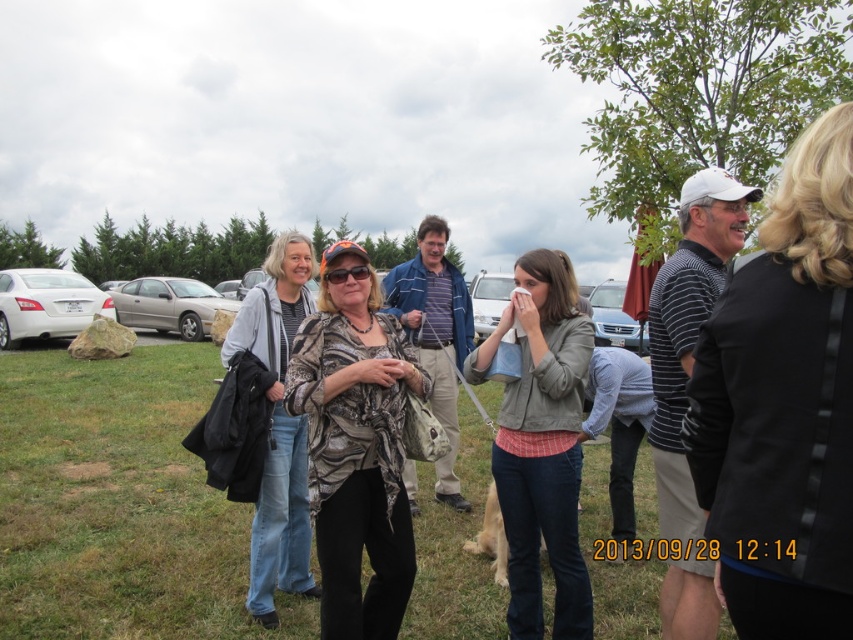
Between green grass at center and black leather jacket at upper right, which one is positioned higher?

Positioned higher is black leather jacket at upper right.

Between point (97, 506) and point (786, 173), which one is positioned in front?

Positioned in front is point (786, 173).

Is point (83, 513) positioned behind point (814, 532)?

Yes, it is.

The height and width of the screenshot is (640, 853). Find the location of `green grass at center`. green grass at center is located at coordinates click(x=119, y=502).

Does black leather jacket at upper right have a smaller size compared to gold metallic sedan at left?

Correct, black leather jacket at upper right occupies less space than gold metallic sedan at left.

Can you confirm if black leather jacket at upper right is bigger than gold metallic sedan at left?

Incorrect, black leather jacket at upper right is not larger than gold metallic sedan at left.

Does point (712, 326) come behind point (199, 328)?

That is False.

I want to click on black leather jacket at upper right, so [782, 404].

Is point (473, 524) behind point (531, 460)?

Yes.

Between point (424, 609) and point (567, 403), which one is positioned in front?

Positioned in front is point (567, 403).

Where is `green grass at center`? The image size is (853, 640). green grass at center is located at coordinates (119, 502).